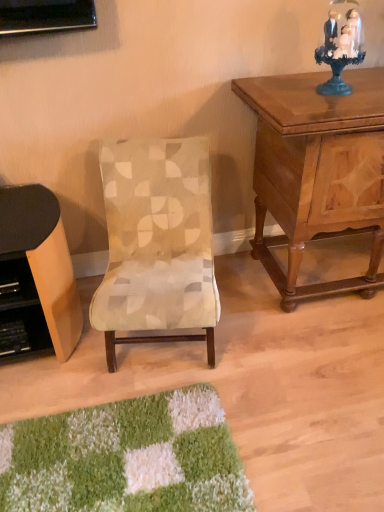
Where is `free space behind blue glass figurine at upper right`? The width and height of the screenshot is (384, 512). free space behind blue glass figurine at upper right is located at coordinates (314, 79).